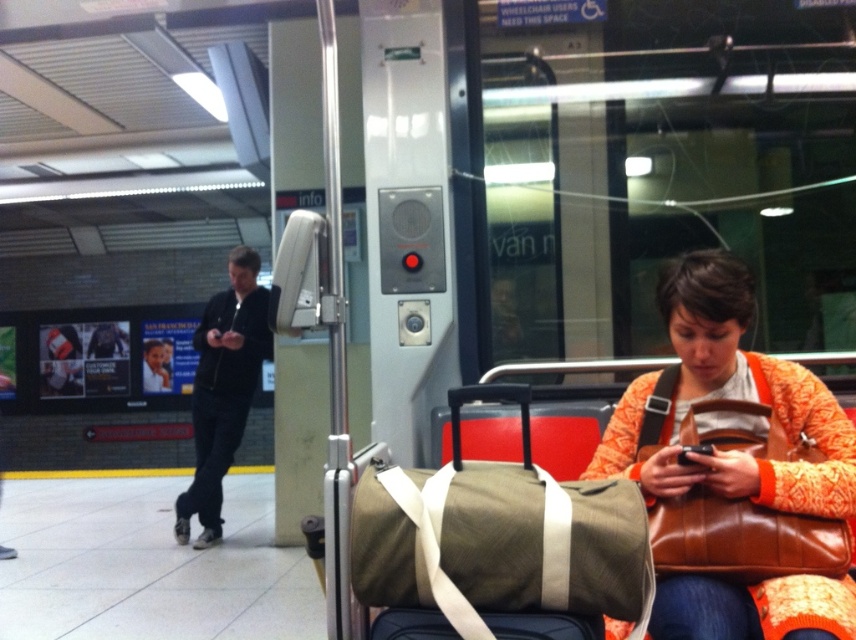
Question: Does orange textured sweater at lower right have a greater width compared to matte green duffel bag at center?

Choices:
 (A) no
 (B) yes

Answer: (B)

Question: Can you confirm if black zip-up jacket at left is bigger than green canvas duffel bag at center?

Choices:
 (A) no
 (B) yes

Answer: (B)

Question: Which point is closer to the camera?

Choices:
 (A) green canvas duffel bag at center
 (B) matte green duffel bag at center
 (C) black zip-up jacket at left
 (D) orange textured sweater at lower right

Answer: (B)

Question: Does orange textured sweater at lower right lie in front of brown leather bag at lower right?

Choices:
 (A) yes
 (B) no

Answer: (A)

Question: Among these objects, which one is farthest from the camera?

Choices:
 (A) black zip-up jacket at left
 (B) orange textured sweater at lower right
 (C) brown leather bag at lower right

Answer: (A)

Question: Which object is closer to the camera taking this photo?

Choices:
 (A) orange textured sweater at lower right
 (B) brown leather bag at lower right
 (C) green canvas duffel bag at center

Answer: (A)